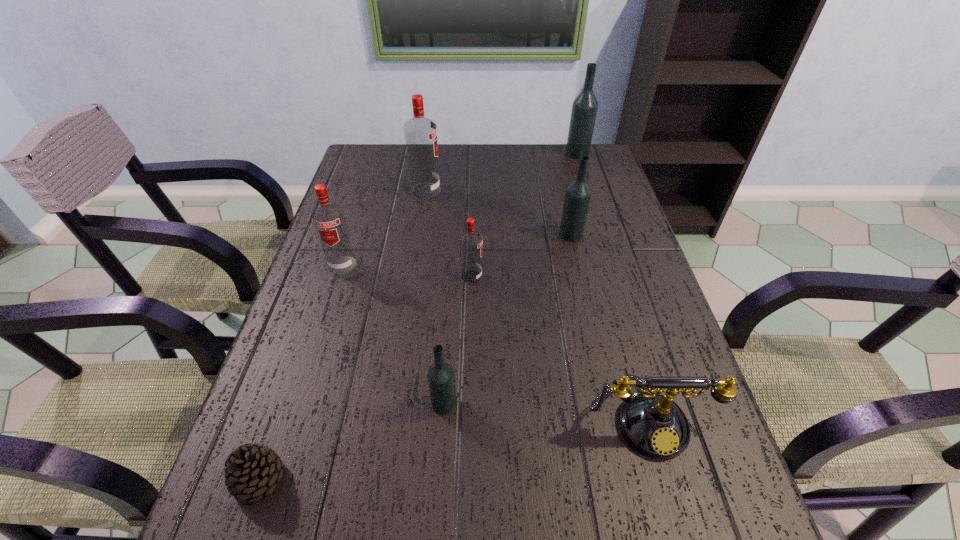
I want to click on the nearest vodka, so click(441, 380).

You are a GUI agent. You are given a task and a screenshot of the screen. Output one action in this format:
    pyautogui.click(x=<x>, y=<y>)
    Task: Click on the telephone
    
    Given the screenshot: What is the action you would take?
    pyautogui.click(x=653, y=424)

You are a GUI agent. You are given a task and a screenshot of the screen. Output one action in this format:
    pyautogui.click(x=<x>, y=<y>)
    Task: Click on the shortest object
    
    Given the screenshot: What is the action you would take?
    pyautogui.click(x=252, y=470)

Locate an element on the screen. The height and width of the screenshot is (540, 960). vacant area located 0.070m on the front of the farthest black vodka is located at coordinates (583, 170).

You are a GUI agent. You are given a task and a screenshot of the screen. Output one action in this format:
    pyautogui.click(x=<x>, y=<y>)
    Task: Click on the vacant space located on the front label of the biggest red vodka
    
    Given the screenshot: What is the action you would take?
    pyautogui.click(x=540, y=191)

This screenshot has width=960, height=540. What are the coordinates of `free space located 0.170m on the back of the fifth vodka from left to right` in the screenshot? It's located at (562, 193).

Image resolution: width=960 pixels, height=540 pixels. Identify the location of vacant space located 0.250m on the front label of the leftmost vodka. (313, 357).

Where is `vacant space located on the front label of the rightmost red vodka`? vacant space located on the front label of the rightmost red vodka is located at coordinates (507, 277).

Identify the location of vacant space situated on the back of the smallest black vodka. The height and width of the screenshot is (540, 960). (447, 347).

This screenshot has width=960, height=540. Identify the location of free spot located on the dial of the telephone. (675, 522).